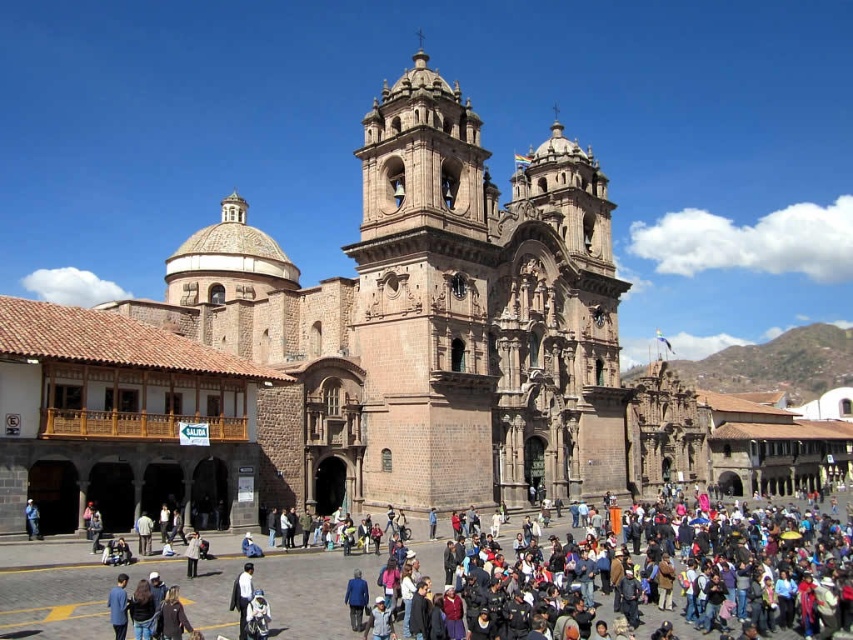
Which of these two, dark blue suit at center or dark blue jeans at lower left, stands taller?

dark blue suit at center is taller.

Is dark blue suit at center wider than dark blue jeans at lower left?

Yes, dark blue suit at center is wider than dark blue jeans at lower left.

Where is `dark blue suit at center`? dark blue suit at center is located at coordinates (242, 596).

Identify the location of dark blue suit at center. (242, 596).

Is multicolored clothing at center bigger than dark blue jeans at lower left?

Yes.

Who is higher up, multicolored clothing at center or dark blue jeans at lower left?

dark blue jeans at lower left is higher up.

Does point (766, 596) come behind point (28, 499)?

No, it is not.

The image size is (853, 640). In order to click on multicolored clothing at center in this screenshot , I will do `click(682, 579)`.

Is multicolored clothing at center to the right of dark blue suit at center from the viewer's perspective?

Indeed, multicolored clothing at center is positioned on the right side of dark blue suit at center.

Can you confirm if multicolored clothing at center is positioned above dark blue suit at center?

Actually, multicolored clothing at center is below dark blue suit at center.

Which is in front, point (795, 541) or point (247, 573)?

Point (247, 573) is in front.

Identify the location of multicolored clothing at center. (682, 579).